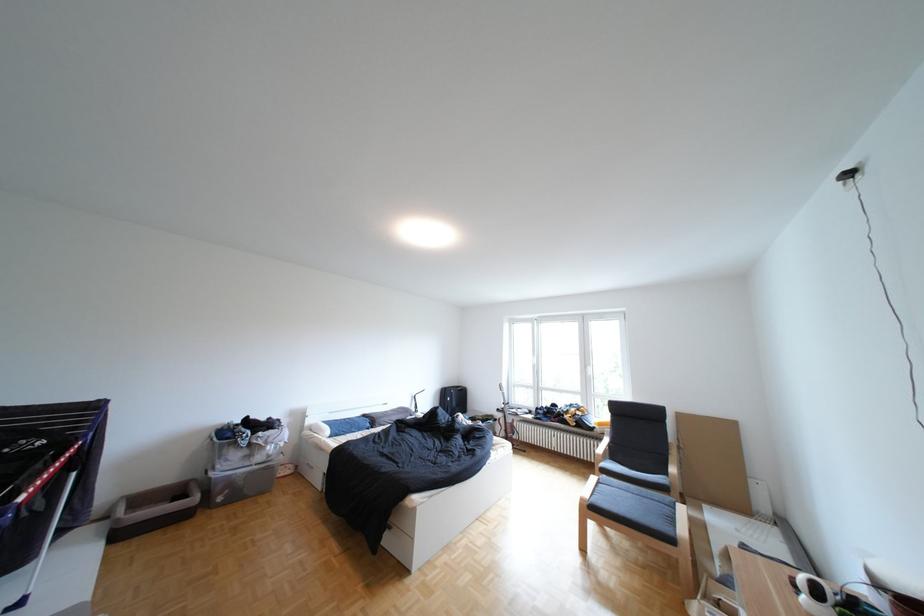
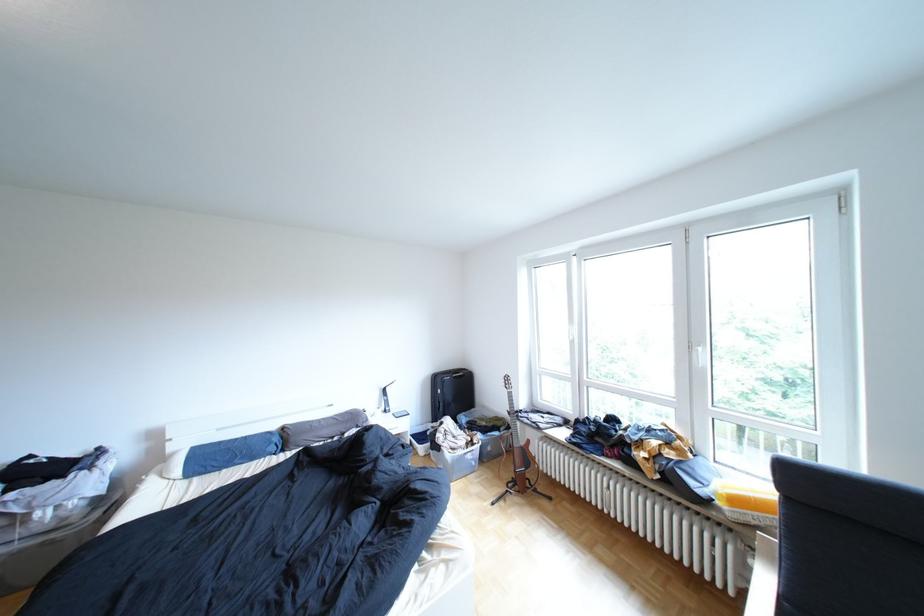
Find the pixel in the second image that matches (x=344, y=432) in the first image.

(193, 472)